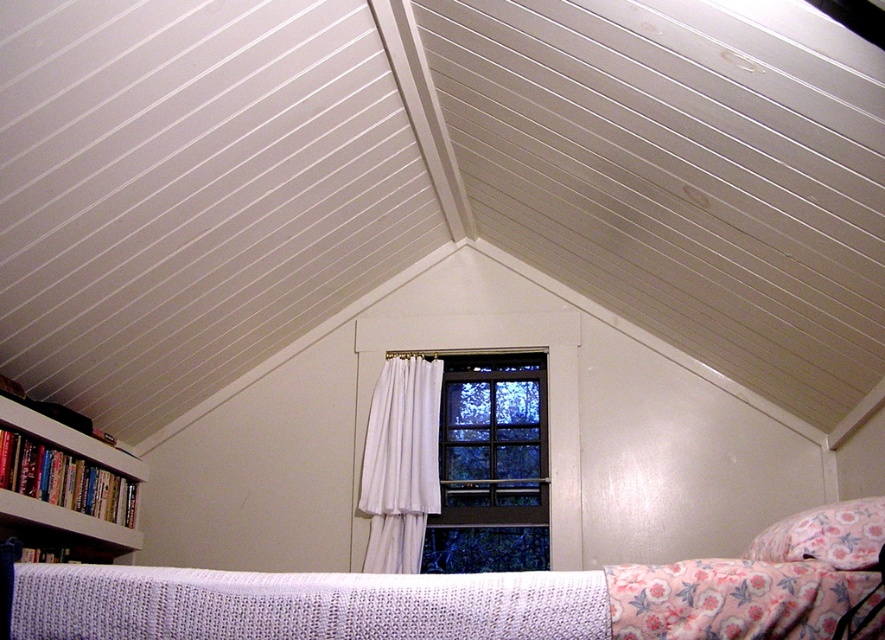
Who is lower down, wooden bookshelf at left or floral fabric pillow at lower right?

wooden bookshelf at left is lower down.

Between wooden bookshelf at left and floral fabric pillow at lower right, which one appears on the left side from the viewer's perspective?

wooden bookshelf at left is more to the left.

Locate an element on the screen. The image size is (885, 640). wooden bookshelf at left is located at coordinates (66, 481).

Who is positioned more to the right, white knitted bed at center or wooden bookshelf at left?

white knitted bed at center

Between point (237, 616) and point (77, 534), which one is positioned behind?

The point (77, 534) is behind.

Find the location of a particular element. The image size is (885, 640). white knitted bed at center is located at coordinates (476, 596).

Which is behind, point (437, 557) or point (830, 515)?

Point (437, 557)

Which is above, clear glass window at center or floral fabric pillow at lower right?

floral fabric pillow at lower right

Does point (449, 556) lie in front of point (827, 563)?

That is False.

Locate an element on the screen. clear glass window at center is located at coordinates click(491, 467).